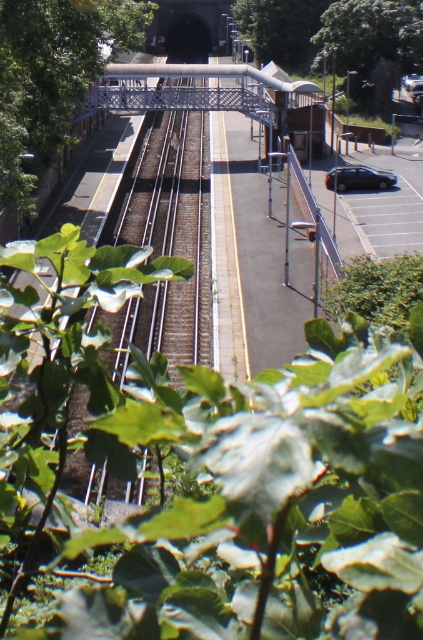
Question: Which point is farther to the camera?

Choices:
 (A) green leafy tree at upper right
 (B) satin black car at right
 (C) green leafy tree at left

Answer: (A)

Question: From the image, what is the correct spatial relationship of green leafy tree at upper right in relation to satin black car at right?

Choices:
 (A) above
 (B) below

Answer: (A)

Question: Among these objects, which one is nearest to the camera?

Choices:
 (A) satin black car at right
 (B) green leafy tree at upper right
 (C) green leafy tree at left

Answer: (C)

Question: Estimate the real-world distances between objects in this image. Which object is closer to the satin black car at right?

Choices:
 (A) green leafy tree at upper right
 (B) green leafy tree at left

Answer: (B)

Question: Observing the image, what is the correct spatial positioning of green leafy tree at left in reference to satin black car at right?

Choices:
 (A) below
 (B) above

Answer: (B)

Question: Does green leafy tree at left have a lesser width compared to satin black car at right?

Choices:
 (A) yes
 (B) no

Answer: (B)